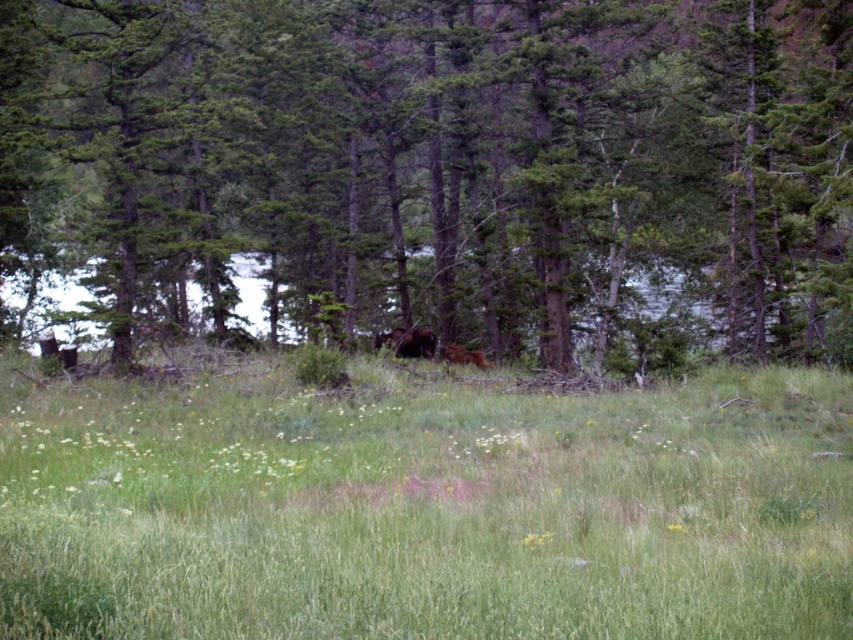
Is green textured tree at center to the left of green grassy field at center from the viewer's perspective?

Correct, you'll find green textured tree at center to the left of green grassy field at center.

Is green textured tree at center to the right of green grassy field at center from the viewer's perspective?

No, green textured tree at center is not to the right of green grassy field at center.

Does point (94, 324) come in front of point (178, 540)?

No.

Identify the location of green textured tree at center. (436, 172).

Who is more forward, (527, 500) or (405, 340)?

Positioned in front is point (527, 500).

Between green grassy field at center and brown furry bear at center, which one has more height?

Standing taller between the two is green grassy field at center.

The height and width of the screenshot is (640, 853). What do you see at coordinates (426, 508) in the screenshot? I see `green grassy field at center` at bounding box center [426, 508].

You are a GUI agent. You are given a task and a screenshot of the screen. Output one action in this format:
    pyautogui.click(x=<x>, y=<y>)
    Task: Click on the green grassy field at center
    
    Given the screenshot: What is the action you would take?
    pyautogui.click(x=426, y=508)

I want to click on green textured tree at center, so click(436, 172).

Can you confirm if green textured tree at center is bigger than brown furry bear at center?

Yes.

From the picture: Measure the distance between green textured tree at center and camera.

green textured tree at center and camera are 14.41 meters apart.

Locate an element on the screen. The width and height of the screenshot is (853, 640). green textured tree at center is located at coordinates (436, 172).